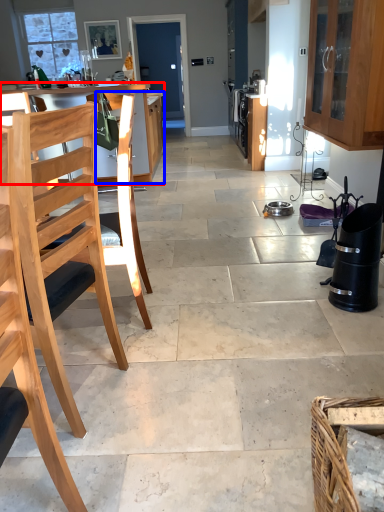
Question: Among these objects, which one is farthest to the camera, table (highlighted by a red box) or cabinetry (highlighted by a blue box)?

Choices:
 (A) table
 (B) cabinetry

Answer: (A)